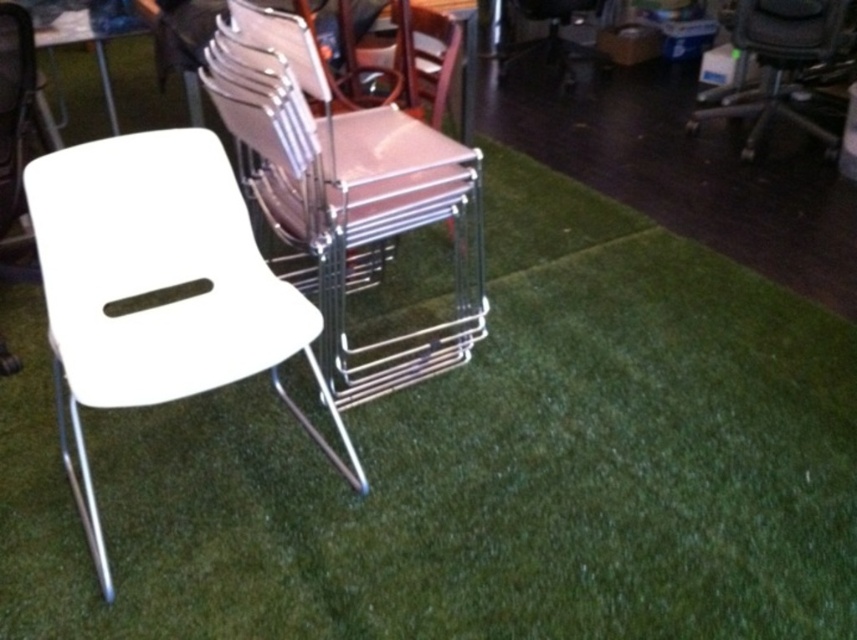
Question: Can you confirm if white glossy chair at center is positioned to the right of white plastic table at upper left?

Choices:
 (A) no
 (B) yes

Answer: (B)

Question: Considering the real-world distances, which object is closest to the white plastic table at upper left?

Choices:
 (A) white plastic chair at center
 (B) white glossy chair at center
 (C) matte black chair at upper right

Answer: (B)

Question: Which point appears closest to the camera in this image?

Choices:
 (A) (108, 115)
 (B) (782, 93)
 (C) (136, 312)

Answer: (C)

Question: Considering the real-world distances, which object is closest to the white plastic chair at center?

Choices:
 (A) white glossy chair at center
 (B) white plastic table at upper left
 (C) matte black chair at upper right

Answer: (A)

Question: Does white plastic chair at center have a lesser width compared to white plastic table at upper left?

Choices:
 (A) yes
 (B) no

Answer: (B)

Question: Is white plastic chair at center thinner than white plastic table at upper left?

Choices:
 (A) yes
 (B) no

Answer: (B)